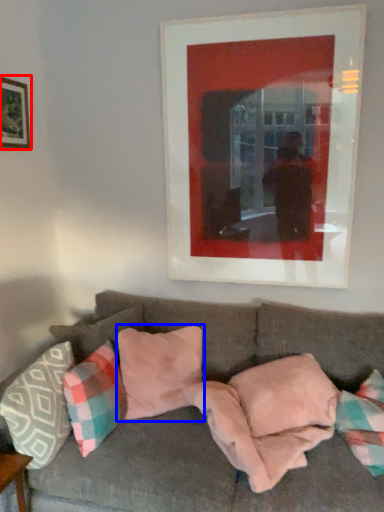
Question: Which point is further to the camera, picture frame (highlighted by a red box) or pillow (highlighted by a blue box)?

Choices:
 (A) picture frame
 (B) pillow

Answer: (A)